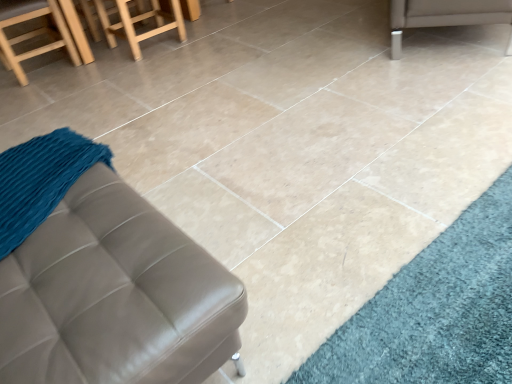
Question: Is wooden stool at upper left in front of or behind wooden stool at upper left in the image?

Choices:
 (A) behind
 (B) front

Answer: (A)

Question: Do you think wooden stool at upper left is within wooden stool at upper left, or outside of it?

Choices:
 (A) inside
 (B) outside

Answer: (B)

Question: Which object is the farthest from the wooden stool at upper left?

Choices:
 (A) leather ottoman at lower left, placed as the 1th furniture when sorted from left to right
 (B) silver metallic leg at upper right, acting as the 1th furniture starting from the top
 (C) wooden stool at upper left

Answer: (B)

Question: Which is farther from the wooden stool at upper left?

Choices:
 (A) leather ottoman at lower left, acting as the 2th furniture starting from the top
 (B) silver metallic leg at upper right, acting as the 1th furniture starting from the top
 (C) wooden stool at upper left

Answer: (A)